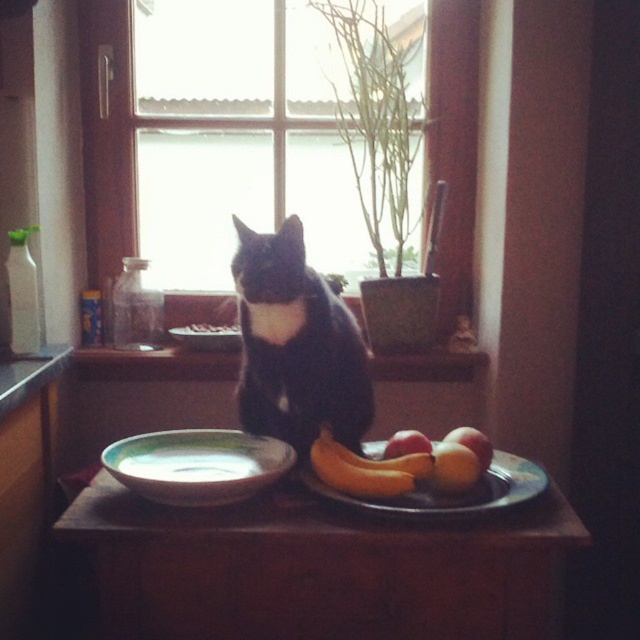
Question: Observing the image, what is the correct spatial positioning of metallic silver platter at lower center in reference to yellow matte banana at lower center?

Choices:
 (A) right
 (B) left

Answer: (A)

Question: Which object is farther from the camera taking this photo?

Choices:
 (A) yellow matte banana at lower center
 (B) matte wooden window sill at center
 (C) transparent glass window at center

Answer: (C)

Question: Which of these objects is positioned farthest from the wooden table at center?

Choices:
 (A) metallic silver platter at lower center
 (B) black fur cat at center
 (C) smooth yellow apple at lower right

Answer: (C)

Question: From the image, what is the correct spatial relationship of metallic silver platter at lower center in relation to yellow matte apple at lower right?

Choices:
 (A) below
 (B) above

Answer: (A)

Question: Can you confirm if black fur cat at center is bigger than yellow matte banana at lower center?

Choices:
 (A) no
 (B) yes

Answer: (B)

Question: Which point is farther from the camera taking this photo?

Choices:
 (A) (321, 372)
 (B) (378, 442)
 (C) (480, 448)
 (D) (387, 547)

Answer: (B)